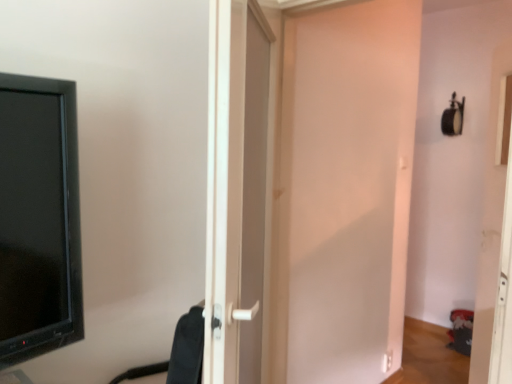
Question: From the image's perspective, is black fabric swivel chair at center positioned above or below white plastic door at center, which is the 1th door in left-to-right order?

Choices:
 (A) above
 (B) below

Answer: (B)

Question: Is black fabric swivel chair at center taller or shorter than white plastic door at center, which appears as the second door when viewed from the right?

Choices:
 (A) tall
 (B) short

Answer: (B)

Question: Estimate the real-world distances between objects in this image. Which object is farther from the white matte door at center, marked as the 1th door in a right-to-left arrangement?

Choices:
 (A) white plastic door at center, which appears as the second door when viewed from the right
 (B) black fabric swivel chair at center

Answer: (B)

Question: Based on their relative distances, which object is farther from the black fabric swivel chair at center?

Choices:
 (A) white matte door at center, marked as the 1th door in a right-to-left arrangement
 (B) white plastic door at center, which appears as the second door when viewed from the right

Answer: (A)